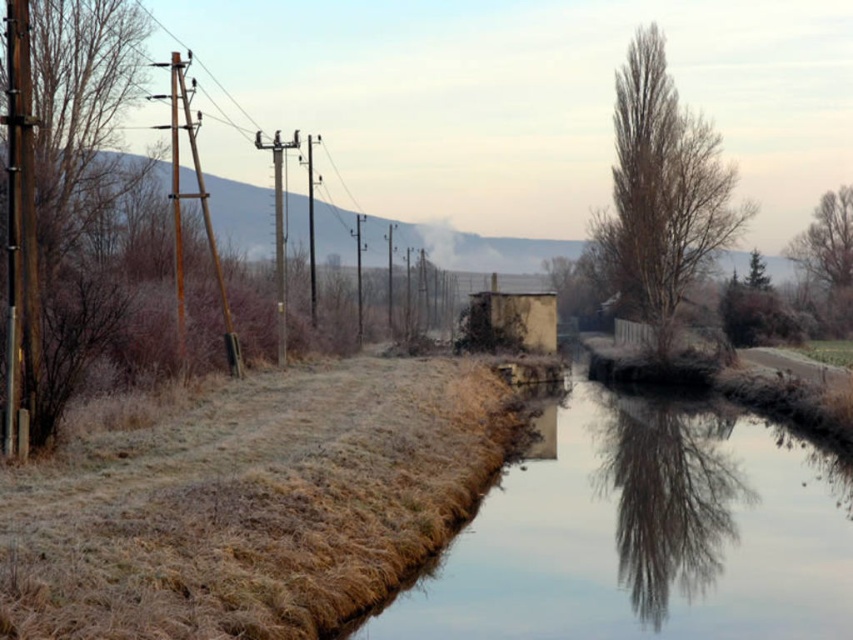
You are standing at the center of the image and want to walk towards the brown textured tree at left. In which direction should you head?

The brown textured tree at left is located at point (68,188), so you should head towards the left direction to reach it.

You are an artist sketching the scene and want to capture the details of the bare brown tree at upper right and the bare branches at upper right. Which of these two has a smaller width when viewed from your perspective?

The bare brown tree at upper right is thinner than the bare branches at upper right, so it has a smaller width when viewed from your perspective.